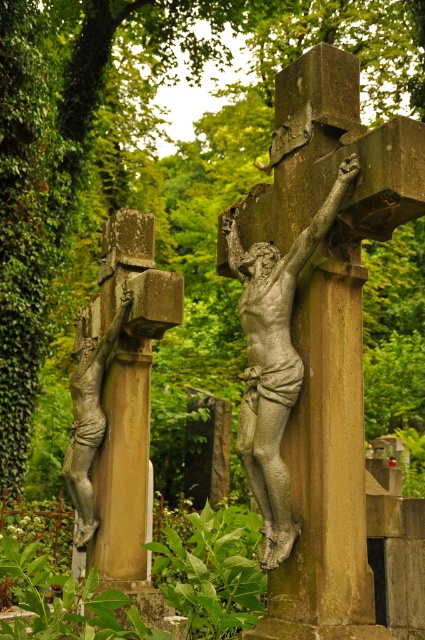
Does brown stone crucifix at center appear on the right side of silver textured crucifix at center?

Indeed, brown stone crucifix at center is positioned on the right side of silver textured crucifix at center.

Is brown stone crucifix at center closer to the viewer compared to silver textured crucifix at center?

Yes.

Where is `brown stone crucifix at center`? brown stone crucifix at center is located at coordinates (328, 332).

Between silver textured crucifix at center and bronze statue of crucifixion figure at left, which one has less height?

Standing shorter between the two is bronze statue of crucifixion figure at left.

Does silver textured crucifix at center appear on the right side of bronze statue of crucifixion figure at left?

Indeed, silver textured crucifix at center is positioned on the right side of bronze statue of crucifixion figure at left.

This screenshot has height=640, width=425. Identify the location of silver textured crucifix at center. (274, 362).

Is bronze statue at left positioned in front of silver textured crucifix at center?

No, bronze statue at left is further to the viewer.

Which is in front, point (161, 301) or point (308, 252)?

Positioned in front is point (308, 252).

Is point (107, 378) positioned before point (261, 442)?

No.

Find the location of a particular element. The image size is (425, 640). bronze statue at left is located at coordinates (121, 403).